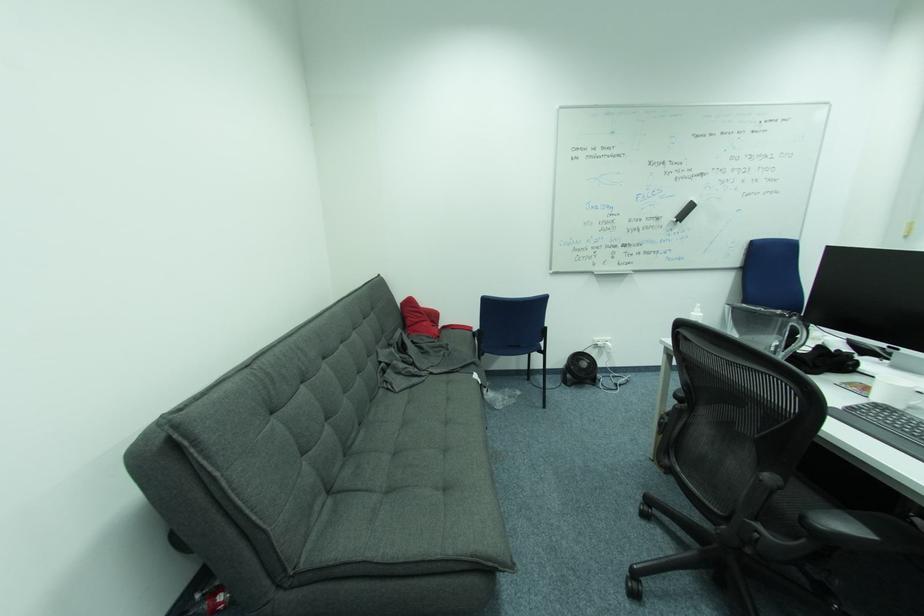
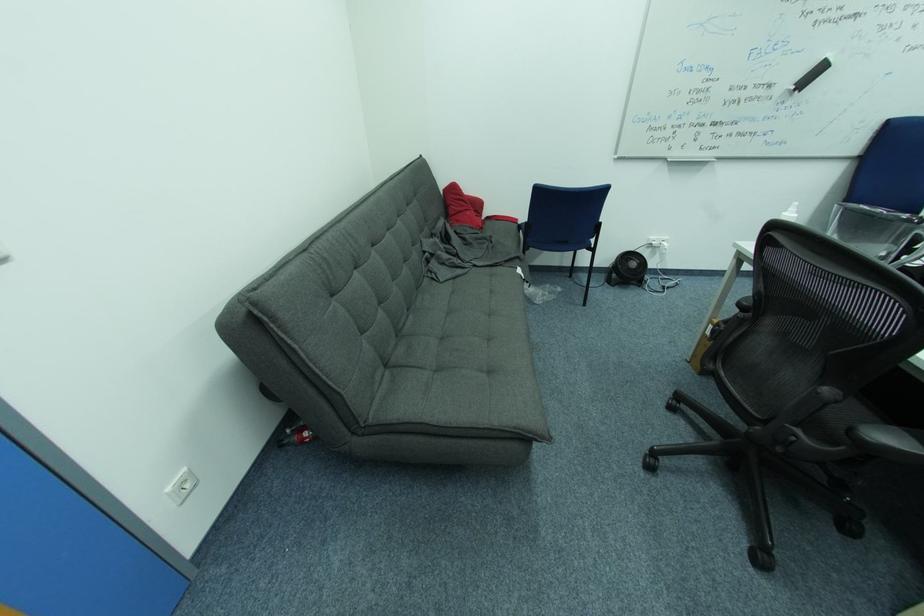
Locate, in the second image, the point that corresponds to the point at 417,302 in the first image.

(459, 188)